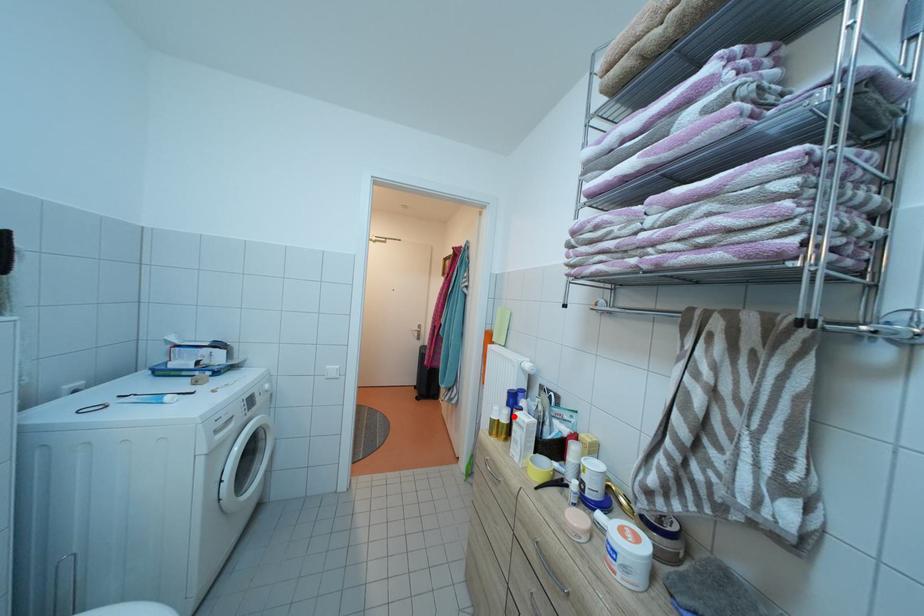
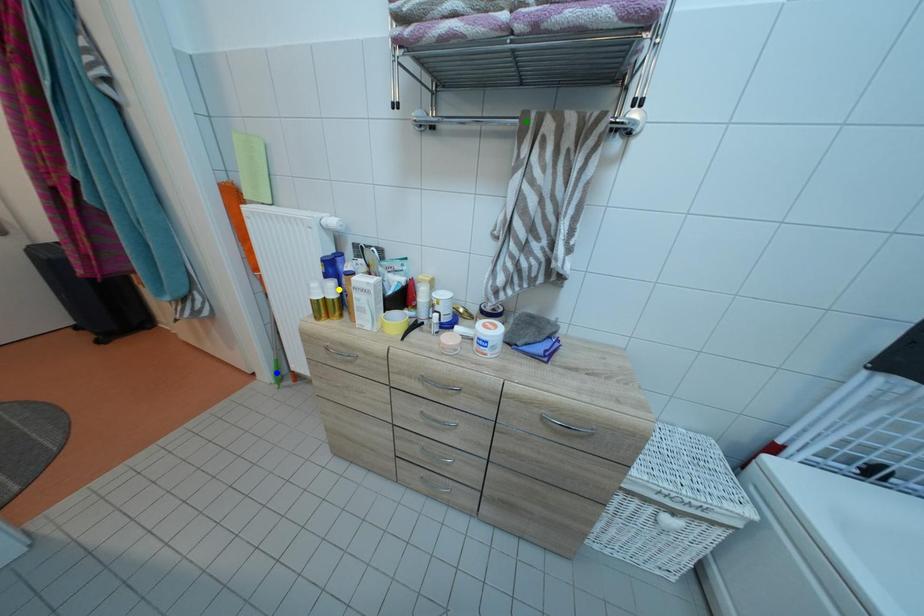
Question: I am providing you with two images of the same scene from different viewpoints. A red point is marked on the first image. You are given multiple points on the second image. Which mark in image 2 goes with the point in image 1?

Choices:
 (A) yellow point
 (B) green point
 (C) blue point

Answer: (A)